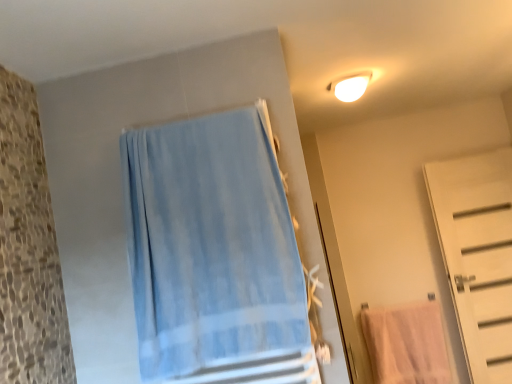
Question: Considering the relative positions of white matte door at right and white glossy light fixture at upper right in the image provided, is white matte door at right to the left or to the right of white glossy light fixture at upper right?

Choices:
 (A) left
 (B) right

Answer: (B)

Question: In terms of height, does white matte door at right look taller or shorter compared to white glossy light fixture at upper right?

Choices:
 (A) short
 (B) tall

Answer: (B)

Question: Based on their relative distances, which object is nearer to the light blue fabric towel at center?

Choices:
 (A) pink cotton towel at lower right
 (B) white glossy light fixture at upper right
 (C) white matte door at right

Answer: (B)

Question: Considering the real-world distances, which object is closest to the white glossy light fixture at upper right?

Choices:
 (A) white matte door at right
 (B) light blue fabric towel at center
 (C) pink cotton towel at lower right

Answer: (B)